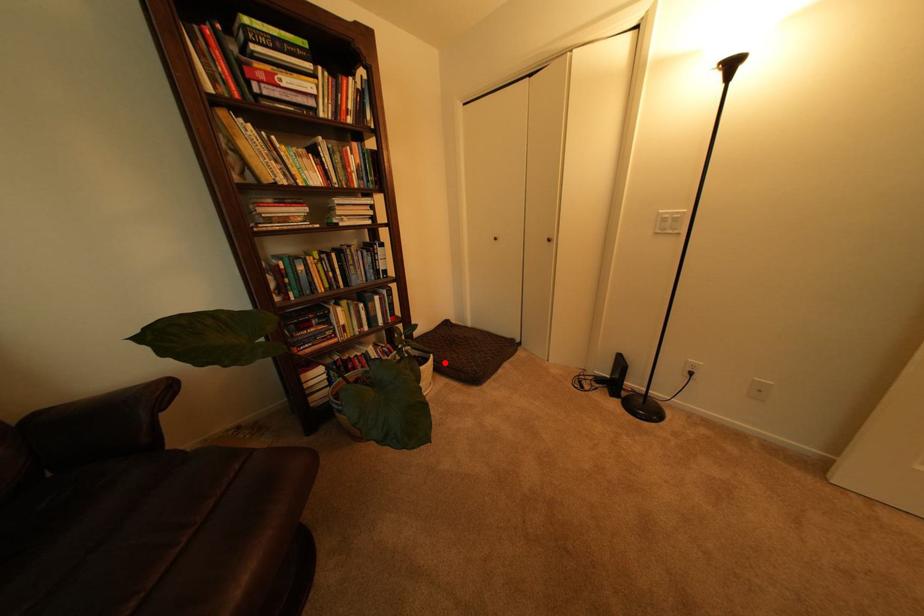
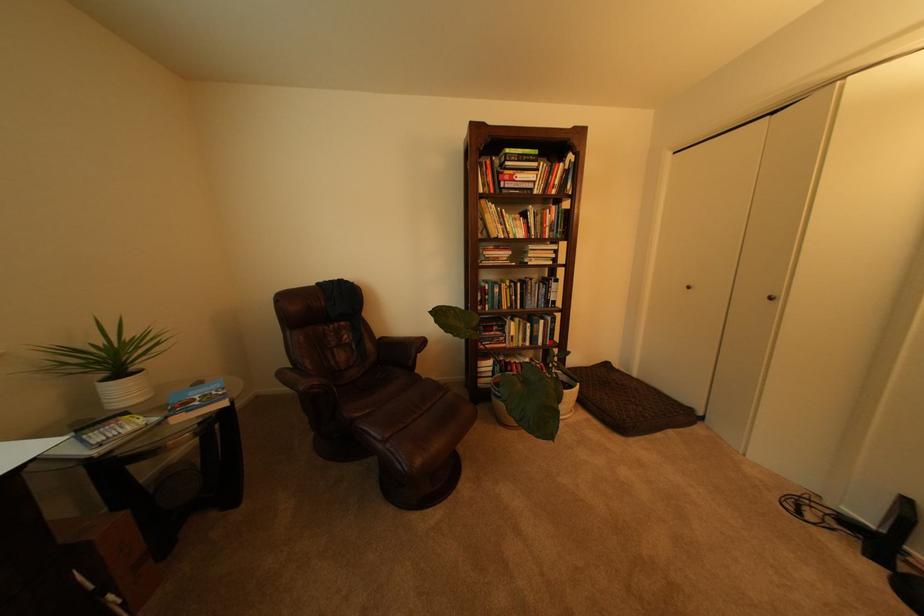
The point at the highlighted location is marked in the first image. Where is the corresponding point in the second image?

(590, 392)